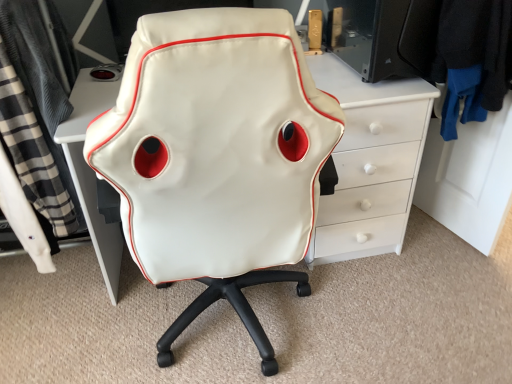
Question: Can you confirm if white leather chair at center is bigger than black fabric jacket at upper right, which is the 1th clothing from right to left?

Choices:
 (A) no
 (B) yes

Answer: (B)

Question: Considering the relative positions of white leather chair at center and black fabric jacket at upper right, the 2th clothing when ordered from left to right, in the image provided, is white leather chair at center to the right of black fabric jacket at upper right, the 2th clothing when ordered from left to right, from the viewer's perspective?

Choices:
 (A) no
 (B) yes

Answer: (A)

Question: Is white leather chair at center located outside black fabric jacket at upper right, which is the 1th clothing from right to left?

Choices:
 (A) yes
 (B) no

Answer: (A)

Question: Can you confirm if white leather chair at center is shorter than black fabric jacket at upper right, which is the 1th clothing from right to left?

Choices:
 (A) yes
 (B) no

Answer: (B)

Question: Does white leather chair at center appear on the left side of black fabric jacket at upper right, the 2th clothing when ordered from left to right?

Choices:
 (A) no
 (B) yes

Answer: (B)

Question: Does white leather chair at center have a greater height compared to black fabric jacket at upper right, the 2th clothing when ordered from left to right?

Choices:
 (A) yes
 (B) no

Answer: (A)

Question: From a real-world perspective, is black fabric jacket at upper right, which is the 1th clothing from right to left, physically below black plaid fabric at left, which appears as the 1th clothing when viewed from the left?

Choices:
 (A) yes
 (B) no

Answer: (B)

Question: Does black fabric jacket at upper right, which is the 1th clothing from right to left, appear on the left side of black plaid fabric at left, which appears as the 1th clothing when viewed from the left?

Choices:
 (A) no
 (B) yes

Answer: (A)

Question: Is black fabric jacket at upper right, which is the 1th clothing from right to left, aimed at black plaid fabric at left, the 2th clothing viewed from the right?

Choices:
 (A) yes
 (B) no

Answer: (A)

Question: Does black fabric jacket at upper right, which is the 1th clothing from right to left, have a greater height compared to black plaid fabric at left, which appears as the 1th clothing when viewed from the left?

Choices:
 (A) yes
 (B) no

Answer: (B)

Question: Is black fabric jacket at upper right, which is the 1th clothing from right to left, located outside black plaid fabric at left, which appears as the 1th clothing when viewed from the left?

Choices:
 (A) no
 (B) yes

Answer: (B)

Question: Are black fabric jacket at upper right, which is the 1th clothing from right to left, and black plaid fabric at left, the 2th clothing viewed from the right, beside each other?

Choices:
 (A) no
 (B) yes

Answer: (A)

Question: From the image's perspective, is white leather chair at center beneath black plaid fabric at left, which appears as the 1th clothing when viewed from the left?

Choices:
 (A) no
 (B) yes

Answer: (B)